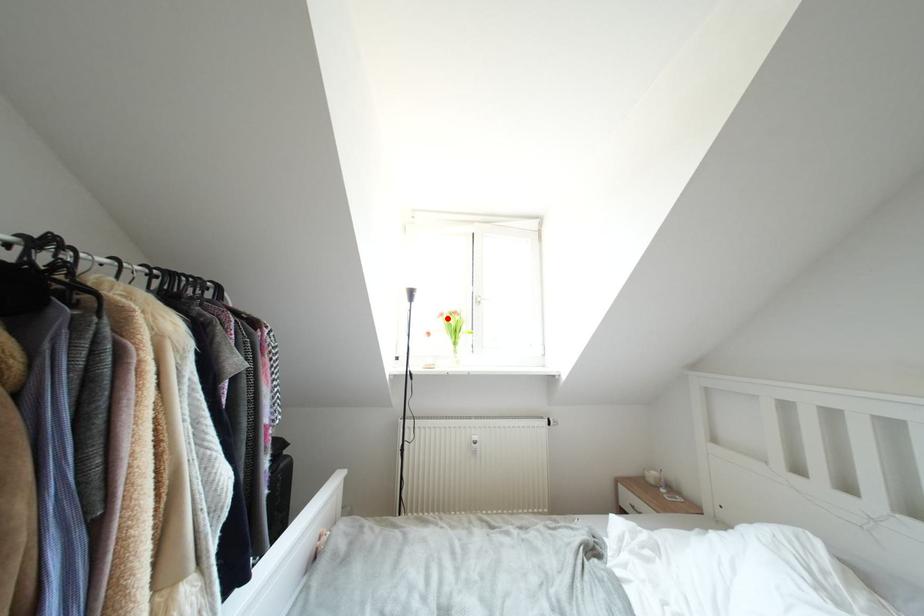
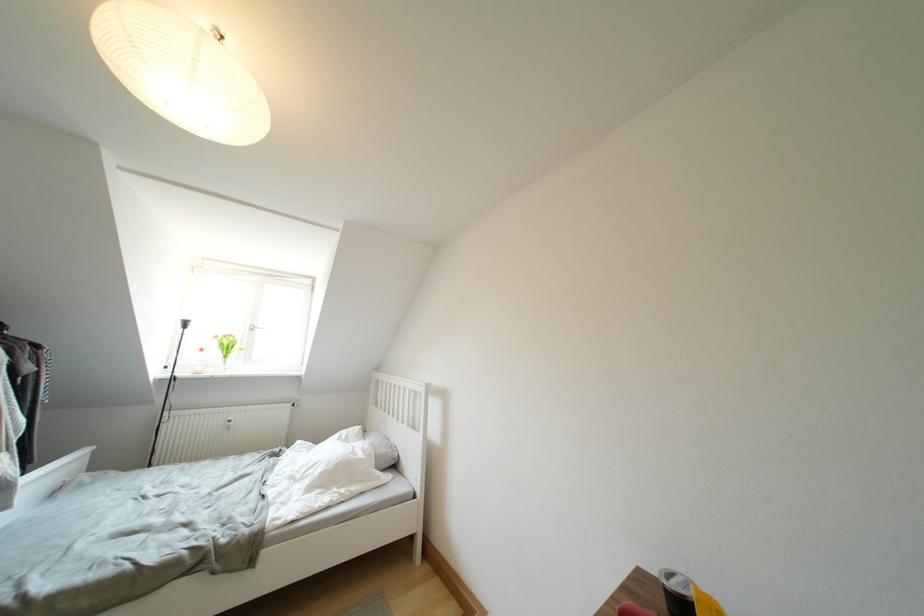
In the second image, find the point that corresponds to the highlighted location in the first image.

(222, 341)